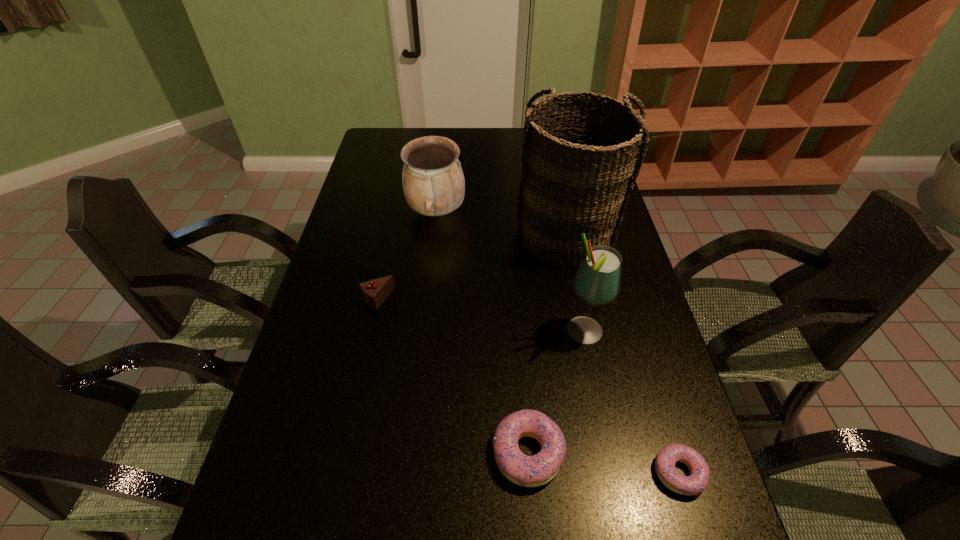
Find the location of a particular element. free spot located 0.250m on the left of the shortest object is located at coordinates (530, 472).

In order to click on vacant space located 0.320m on the back of the third tallest object in this screenshot , I will do `click(444, 146)`.

Locate an element on the screen. vacant point located 0.160m on the front of the basket is located at coordinates (580, 314).

Find the location of a particular element. This screenshot has height=540, width=960. vacant space located 0.370m on the back of the fifth shortest object is located at coordinates (563, 226).

The height and width of the screenshot is (540, 960). In order to click on vacant position located 0.390m on the right of the chocolate cake in this screenshot , I will do click(536, 299).

You are a GUI agent. You are given a task and a screenshot of the screen. Output one action in this format:
    pyautogui.click(x=<x>, y=<y>)
    Task: Click on the object that is at the left edge
    This screenshot has height=540, width=960.
    Given the screenshot: What is the action you would take?
    pyautogui.click(x=374, y=292)

You are a GUI agent. You are given a task and a screenshot of the screen. Output one action in this format:
    pyautogui.click(x=<x>, y=<y>)
    Task: Click on the doughnut that is at the right edge
    
    Given the screenshot: What is the action you would take?
    pyautogui.click(x=697, y=481)

I want to click on basket present at the right edge, so click(x=579, y=163).

Locate an element on the screen. The height and width of the screenshot is (540, 960). alcohol present at the right edge is located at coordinates (597, 282).

The image size is (960, 540). I want to click on object positioned at the near right corner, so click(x=697, y=481).